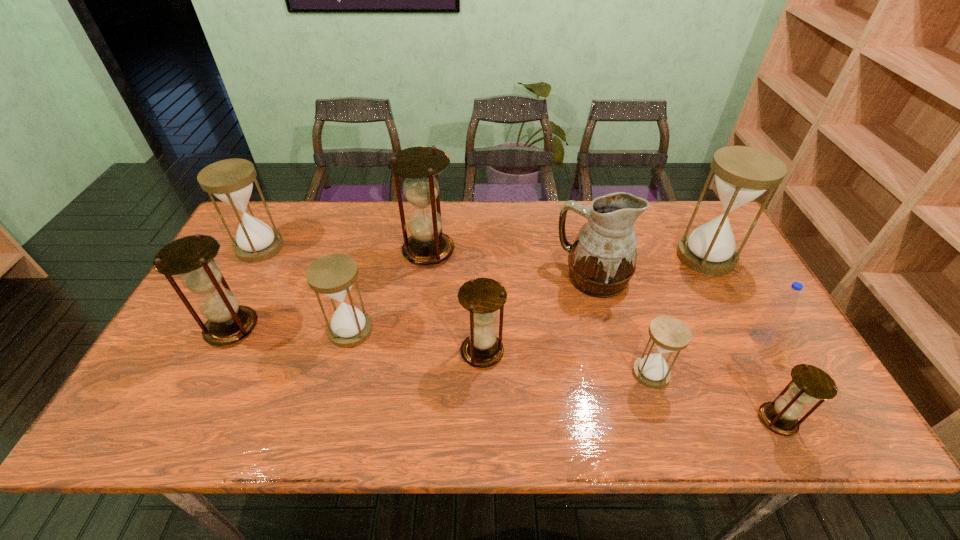
Find the location of `the farthest brown hourglass`. the farthest brown hourglass is located at coordinates (427, 245).

Locate an element on the screen. This screenshot has width=960, height=540. the fifth hourglass from right to left is located at coordinates (427, 245).

Identify the location of the rightmost white hourglass. The height and width of the screenshot is (540, 960). (742, 174).

The image size is (960, 540). I want to click on pitcher, so click(x=602, y=260).

Locate an element on the screen. The height and width of the screenshot is (540, 960). the leftmost white hourglass is located at coordinates (231, 180).

Identify the location of the leftmost brown hourglass. (192, 257).

This screenshot has width=960, height=540. I want to click on the fourth hourglass from right to left, so click(x=482, y=297).

Where is `the fifth object from left to right`? This screenshot has width=960, height=540. the fifth object from left to right is located at coordinates (482, 297).

Identify the location of the second nearest white hourglass. (333, 275).

Find the location of `the third object from left to right`. the third object from left to right is located at coordinates (333, 275).